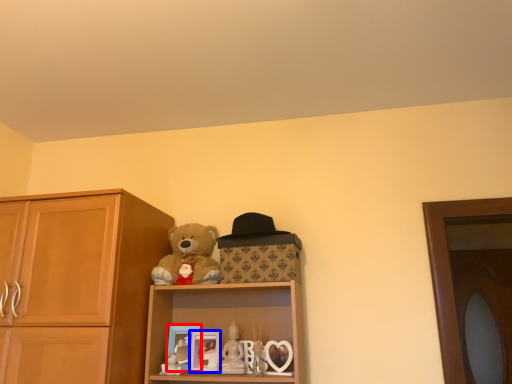
Question: Which point is further to the camera, picture frame (highlighted by a red box) or picture frame (highlighted by a blue box)?

Choices:
 (A) picture frame
 (B) picture frame

Answer: (A)